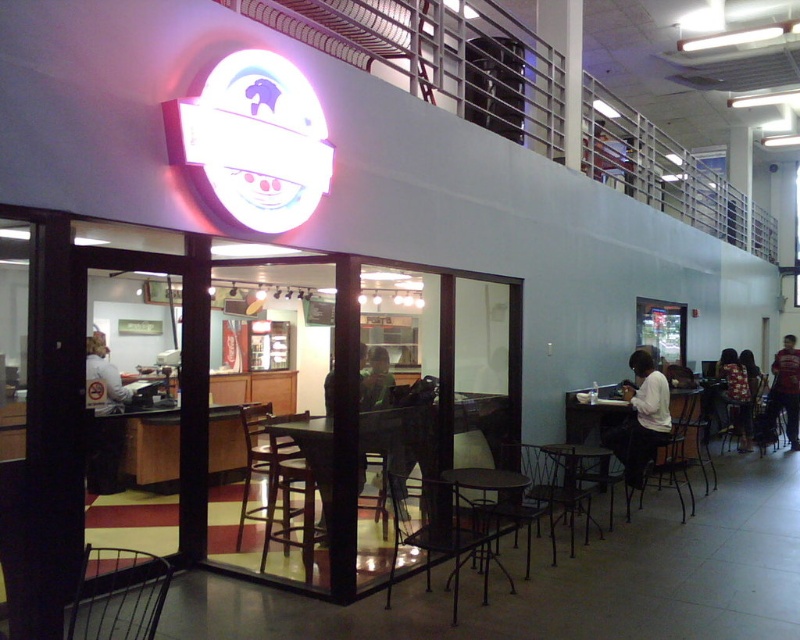
Which is behind, point (656, 444) or point (744, 426)?

The point (744, 426) is behind.

Does white matte shirt at lower right have a larger size compared to metallic black chair at lower right?

No.

This screenshot has height=640, width=800. What do you see at coordinates (641, 419) in the screenshot?
I see `white matte shirt at lower right` at bounding box center [641, 419].

Locate an element on the screen. This screenshot has width=800, height=640. white matte shirt at lower right is located at coordinates click(641, 419).

Is matte black table at center taller than white fabric shirt at left?

Incorrect, matte black table at center's height is not larger of white fabric shirt at left's.

Looking at this image, can you confirm if matte black table at center is positioned to the left of white fabric shirt at left?

No, matte black table at center is not to the left of white fabric shirt at left.

Locate an element on the screen. The width and height of the screenshot is (800, 640). matte black table at center is located at coordinates (592, 413).

The image size is (800, 640). What are the coordinates of `matte black table at center` in the screenshot? It's located at (592, 413).

Based on the photo, can you confirm if metallic bar stool at center is smaller than metallic black chair at lower right?

No, metallic bar stool at center is not smaller than metallic black chair at lower right.

Between point (670, 476) and point (748, 419), which one is positioned behind?

Positioned behind is point (748, 419).

Identify the location of metallic bar stool at center. [x=686, y=440].